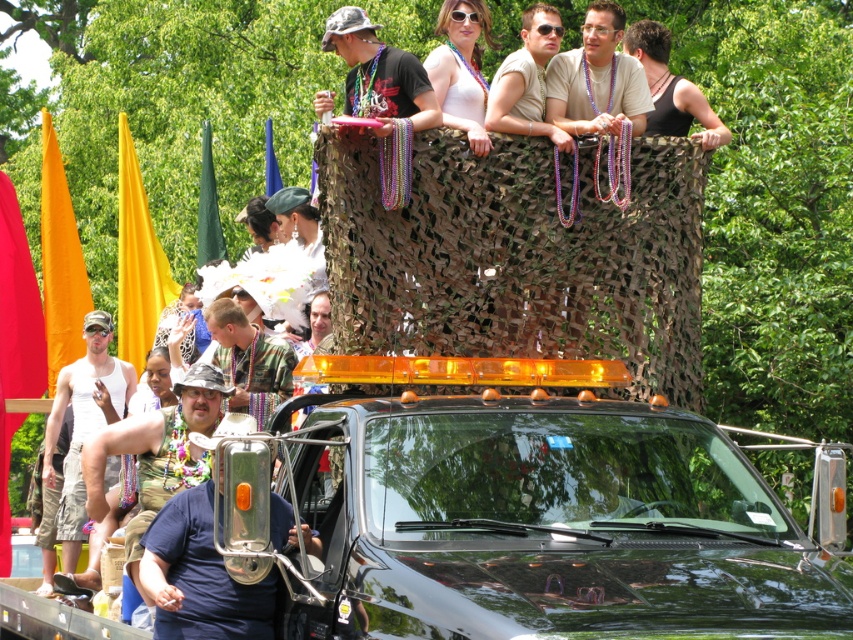
You are standing in the parade area and want to throw a balloon to someone. You have two points to choose from, point (201, 497) and point (431, 99). Which point should you aim for if you want the balloon to land closer to you?

Point (201, 497) is closer to the viewer than point (431, 99), so you should aim for point (201, 497) to have the balloon land closer to you.

Imagine you are standing at the very front of the black vehicle in the image. You want to take a photo of the white matte tank top at center. In which direction should you move your camera to capture it in the frame?

Since the white matte tank top at center is located at point 0.661 on the x axis and 0.098 on the y axis, you should move your camera slightly to the right and down to capture it in the frame.

You are a photographer trying to capture the scene from the front of the black vehicle. You notice the brushed metal bell at center and the matte black sunglasses at upper center. Which object would appear larger in your photo?

The brushed metal bell at center appears larger because it is closer to the viewer than the matte black sunglasses at upper center.